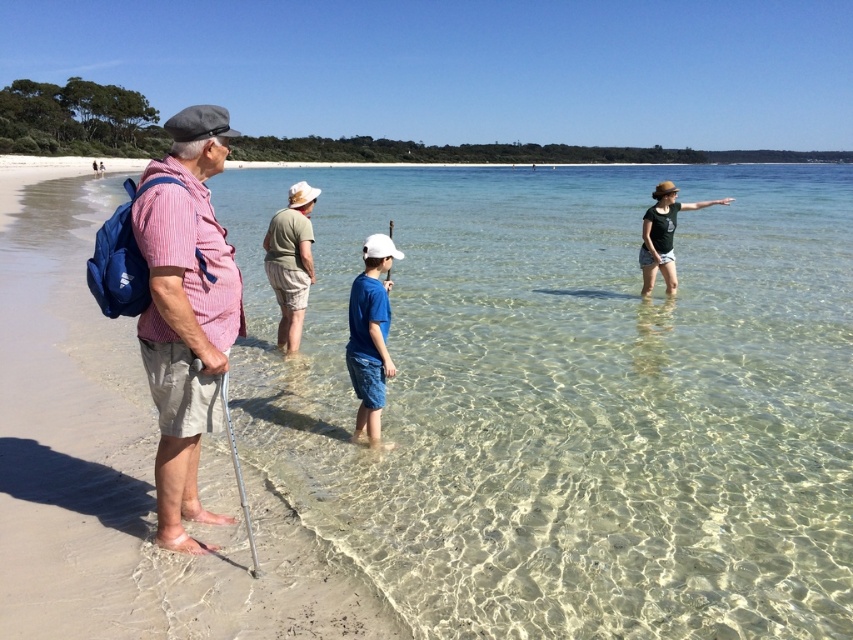
You are a photographer planning to take a group photo of the striped cotton shirt at left and the clear glassy water at center. Considering the scene, which object occupies a wider area in the image?

The clear glassy water at center occupies a wider area in the image than the striped cotton shirt at left, as its width is larger.

You are a photographer planning to take a group photo of the people on the smooth sand beach at left and the striped cotton shirt at left. If you want to ensure everyone is in focus, what is the minimum focusing distance you should set?

The minimum focusing distance should be at least 16.94 feet to ensure both the smooth sand beach at left and the striped cotton shirt at left are in focus.

You are planning to walk from the smooth sand beach at left to the clear glassy water at center. Based on the scene description, which path is wider?

The clear glassy water at center has a larger width than the smooth sand beach at left, so the path to the clear glassy water at center is wider.